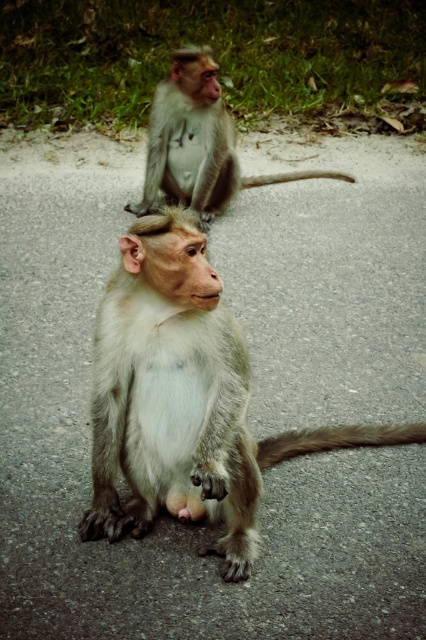
You are a photographer trying to capture both the gray furry monkey at center and the gray fur monkey at upper center in a single shot. Based on their positions, which monkey is closer to the camera?

The gray furry monkey at center is positioned under the gray fur monkey at upper center, meaning it is closer to the camera.

You are standing at the camera position and want to throw a banana to the gray furry monkey at center. If your throwing range is 2 meters, will you be able to reach it?

The gray furry monkey at center is 2.06 meters away from the camera, so the throwing range of 2 meters is insufficient to reach it.

You are a photographer trying to capture both monkeys in a single shot. Since you want to include both the gray furry monkey at center and the gray fur monkey at upper center in your photo, which monkey is positioned more to the left side of the image?

The gray furry monkey at center is positioned to the left of the gray fur monkey at upper center, so the gray furry monkey at center is more to the left side of the image.